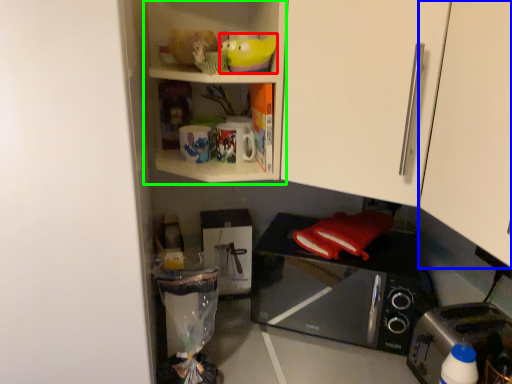
Question: Estimate the real-world distances between objects in this image. Which object is farther from toy (highlighted by a red box), cabinetry (highlighted by a blue box) or cabinet (highlighted by a green box)?

Choices:
 (A) cabinetry
 (B) cabinet

Answer: (A)